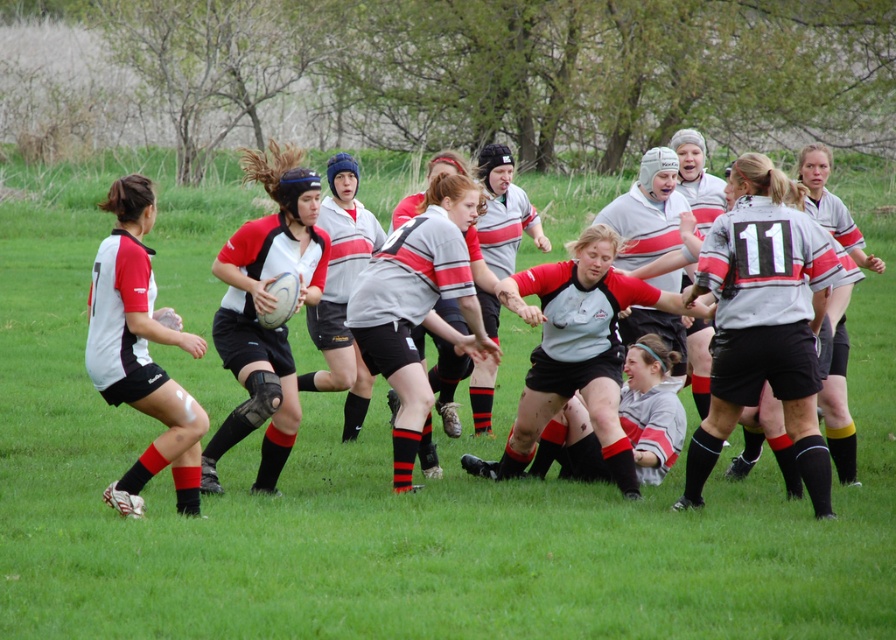
You are a referee observing the rugby match. You notice the matte black rugby ball at center and the gray matte rugby jersey at center. Based on their positions, which object is closer to the front of the field?

The matte black rugby ball at center is closer to the front of the field because it is positioned in front of the gray matte rugby jersey at center.

You are a referee standing 3 feet away from the matte black rugby ball at center. You need to determine if the gray matte rugby jersey at center is within the 30 inch penalty zone around the ball. Is the jersey within the zone?

The distance between the matte black rugby ball at center and the gray matte rugby jersey at center is 25.86 inches, which is less than 30 inches. Therefore, the jersey is within the penalty zone.

You are a referee observing the rugby match. You notice the matte black rugby ball at center and the gray matte rugby jersey at center. Which object is positioned higher in the image?

The matte black rugby ball at center is above the gray matte rugby jersey at center, so the matte black rugby ball at center is positioned higher in the image.